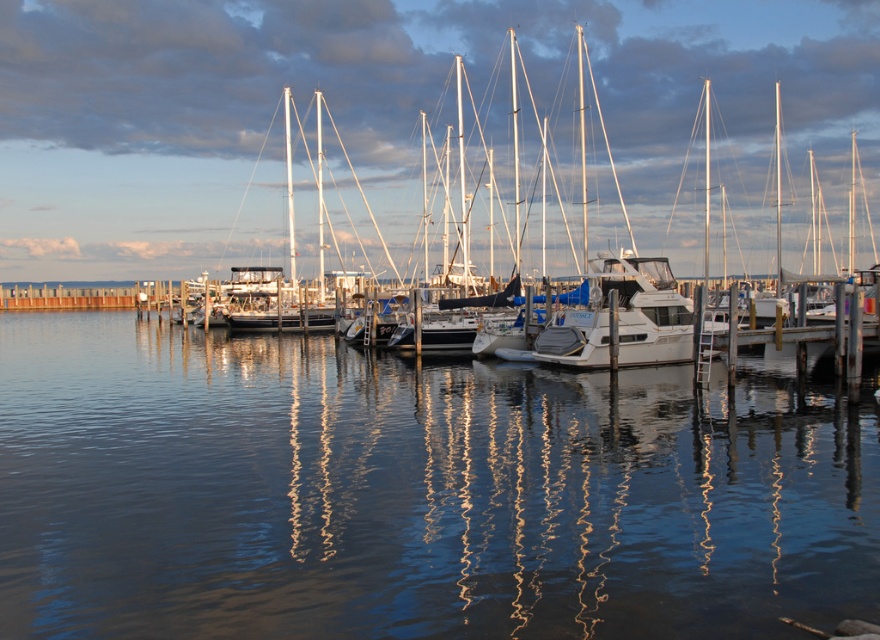
Question: Which point is farther to the camera?

Choices:
 (A) (517, 404)
 (B) (270, 40)

Answer: (B)

Question: Does clear water at center appear on the left side of white glossy sailboat at center?

Choices:
 (A) yes
 (B) no

Answer: (B)

Question: From the image, what is the correct spatial relationship of clear water at center in relation to white glossy boat at center?

Choices:
 (A) right
 (B) left

Answer: (B)

Question: Among these points, which one is nearest to the camera?

Choices:
 (A) (70, 390)
 (B) (534, 355)

Answer: (A)

Question: Which point appears closest to the camera in this image?

Choices:
 (A) (541, 336)
 (B) (308, 413)

Answer: (B)

Question: Can you confirm if white glossy sailboat at center is positioned to the left of white glossy boat at center?

Choices:
 (A) yes
 (B) no

Answer: (A)